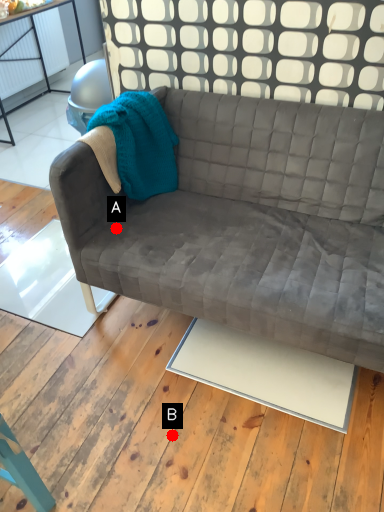
Question: Two points are circled on the image, labeled by A and B beside each circle. Which point is farther from the camera taking this photo?

Choices:
 (A) A is further
 (B) B is further

Answer: (A)